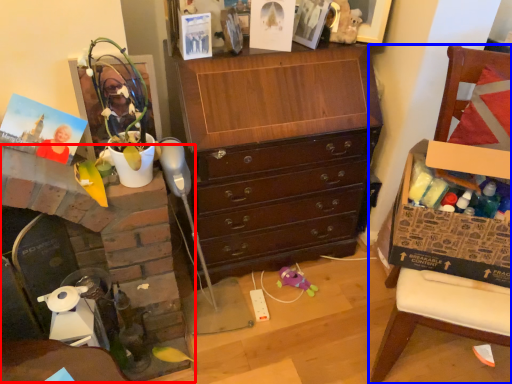
Question: Which object is further to the camera taking this photo, fireplace (highlighted by a red box) or furniture (highlighted by a blue box)?

Choices:
 (A) fireplace
 (B) furniture

Answer: (A)